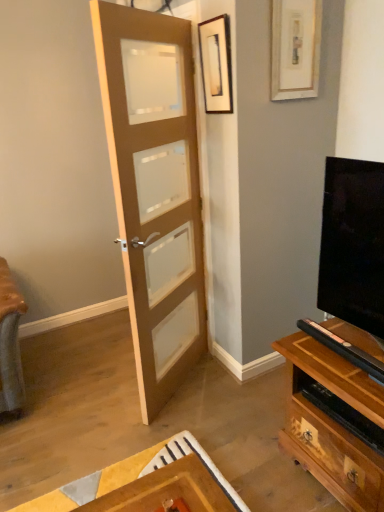
Question: From the image's perspective, is black glossy tv at right above matte wood door at center?

Choices:
 (A) no
 (B) yes

Answer: (A)

Question: Does black glossy tv at right contain matte wood door at center?

Choices:
 (A) no
 (B) yes

Answer: (A)

Question: Can you confirm if black glossy tv at right is shorter than matte wood door at center?

Choices:
 (A) yes
 (B) no

Answer: (A)

Question: Could you tell me if black glossy tv at right is facing matte wood door at center?

Choices:
 (A) yes
 (B) no

Answer: (B)

Question: Is black glossy tv at right to the right of matte wood door at center from the viewer's perspective?

Choices:
 (A) no
 (B) yes

Answer: (B)

Question: From a real-world perspective, is black glossy tv at right below matte wood door at center?

Choices:
 (A) yes
 (B) no

Answer: (A)

Question: Does matte wood door at center have a larger size compared to white matte picture frame at upper right, which is the 1th picture frame in right-to-left order?

Choices:
 (A) yes
 (B) no

Answer: (A)

Question: Could you tell me if matte wood door at center is turned towards white matte picture frame at upper right, the 2th picture frame positioned from the left?

Choices:
 (A) yes
 (B) no

Answer: (B)

Question: Can you confirm if matte wood door at center is smaller than white matte picture frame at upper right, which is the 1th picture frame in right-to-left order?

Choices:
 (A) no
 (B) yes

Answer: (A)

Question: Is matte wood door at center outside white matte picture frame at upper right, which is the 1th picture frame in right-to-left order?

Choices:
 (A) no
 (B) yes

Answer: (B)

Question: Is matte wood door at center turned away from white matte picture frame at upper right, which is the 1th picture frame in right-to-left order?

Choices:
 (A) yes
 (B) no

Answer: (A)

Question: Are matte wood door at center and white matte picture frame at upper right, the 2th picture frame positioned from the left, making contact?

Choices:
 (A) yes
 (B) no

Answer: (B)

Question: From a real-world perspective, is wooden framed picture at upper center, the first picture frame when ordered from left to right, on matte wood door at center?

Choices:
 (A) no
 (B) yes

Answer: (B)